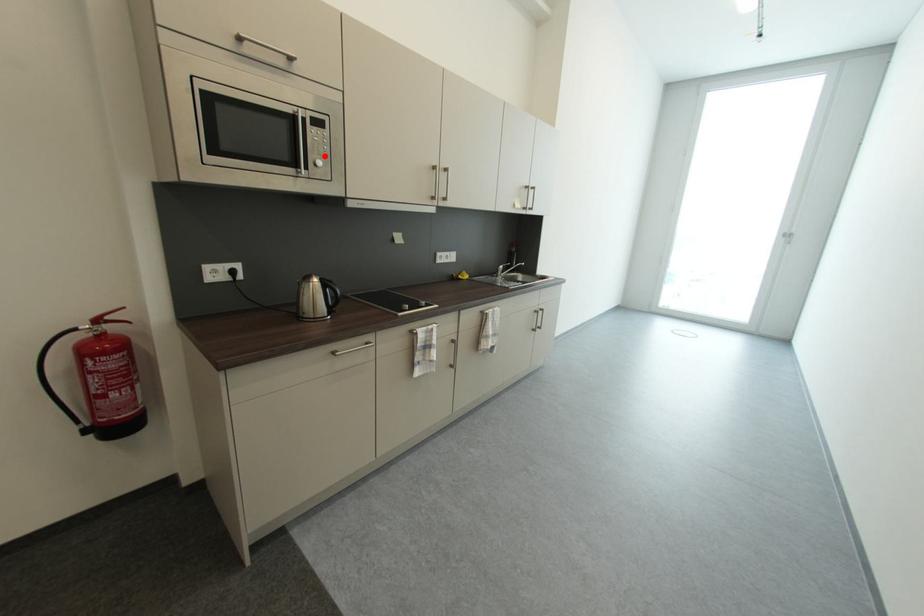
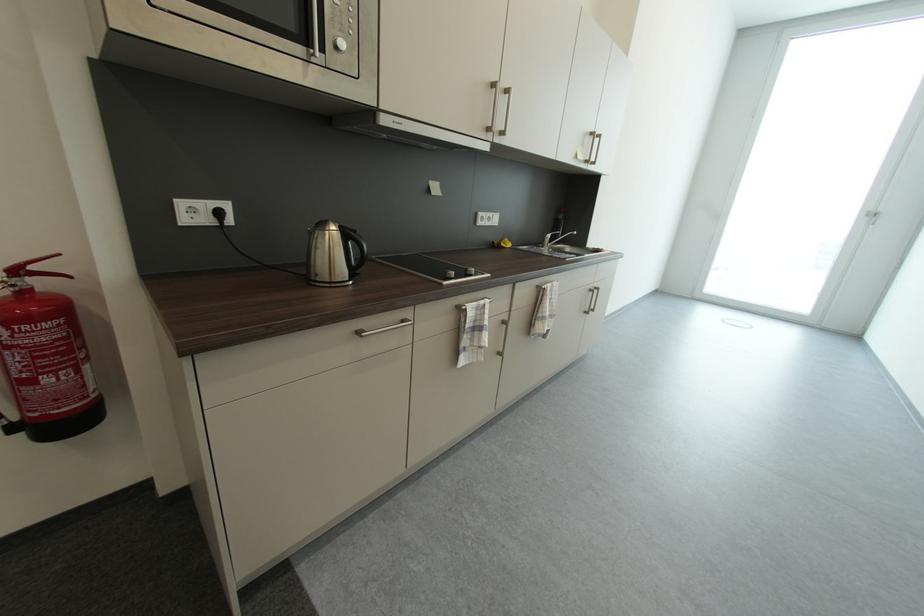
Locate, in the second image, the point that corresponds to the highlighted location in the first image.

(347, 33)